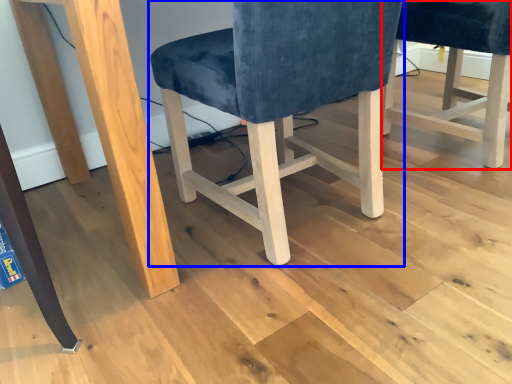
Question: Which of the following is the closest to the observer, chair (highlighted by a red box) or chair (highlighted by a blue box)?

Choices:
 (A) chair
 (B) chair

Answer: (B)